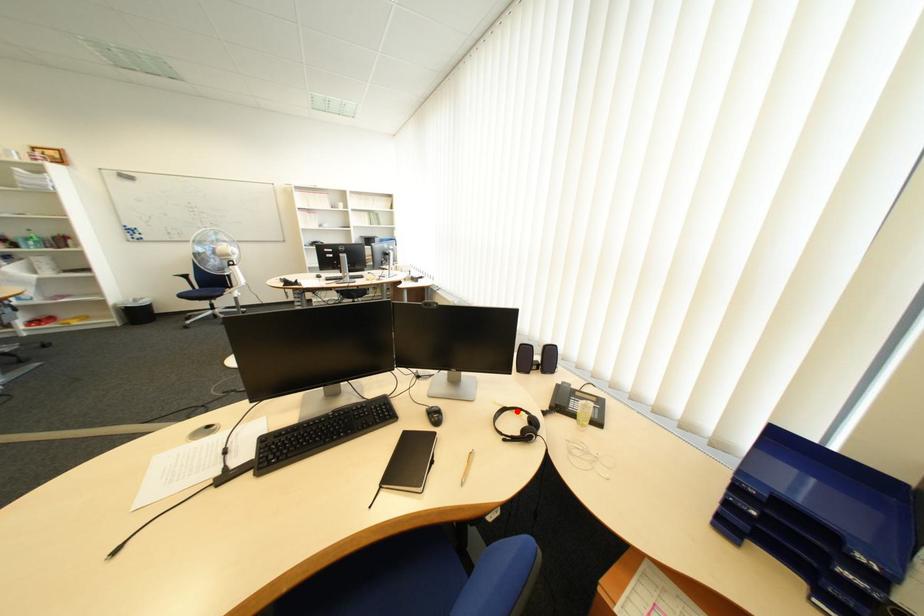
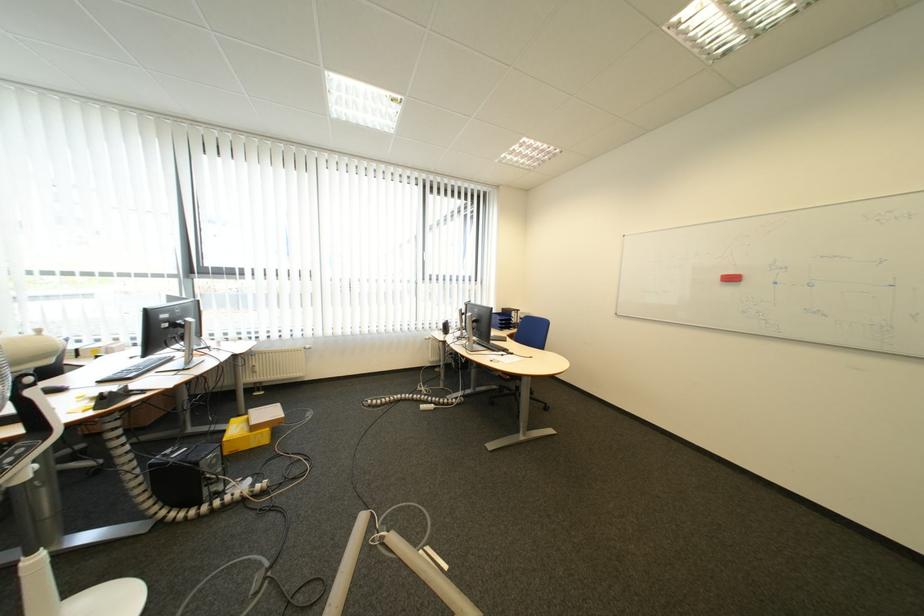
Question: I am providing you with two images of the same scene from different viewpoints. A red point is marked on the first image. Can you still see the location of the red point in image 2?

Choices:
 (A) Yes
 (B) No

Answer: (B)